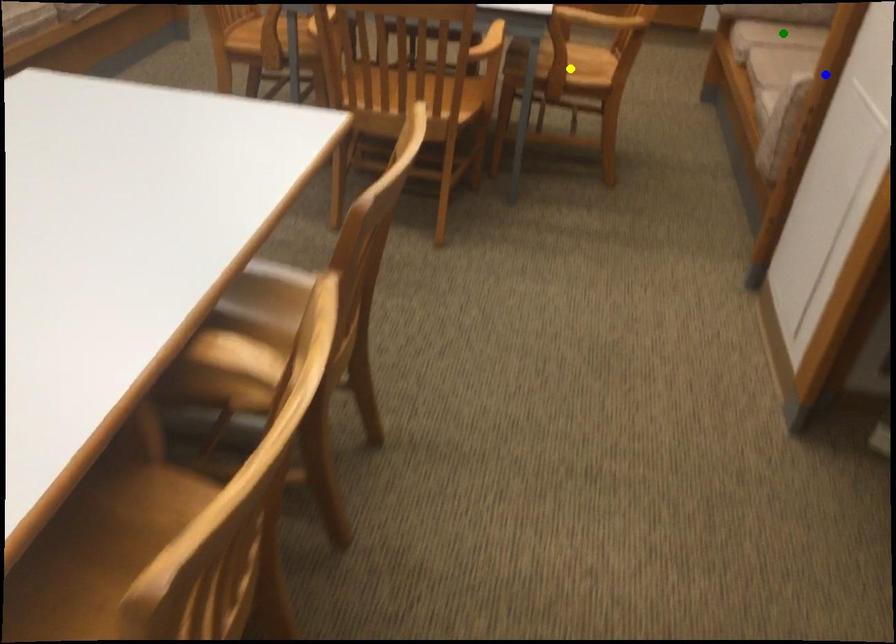
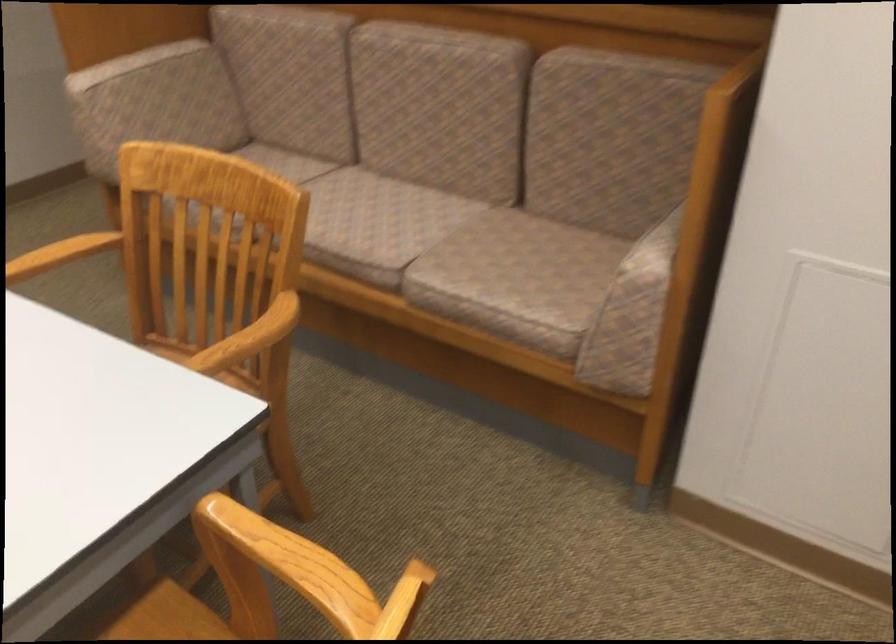
I am providing you with two images of the same scene from different viewpoints. Three points are marked in image1. Which point corresponds to a part or object that is occluded in image2?In image1, three points are marked. Which of them correspond to a part or object that is occluded in image2?Among the three points shown in image1, which one corresponds to a part or object that is no longer visible due to occlusion in image2?

Invisible in image2: yellow point, green point.